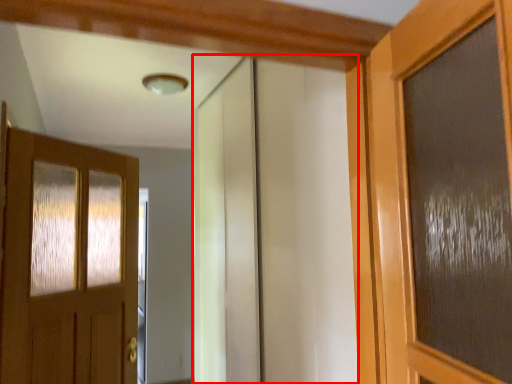
Question: From the image's perspective, what is the correct spatial relationship of elevator (annotated by the red box) in relation to door?

Choices:
 (A) below
 (B) above

Answer: (B)